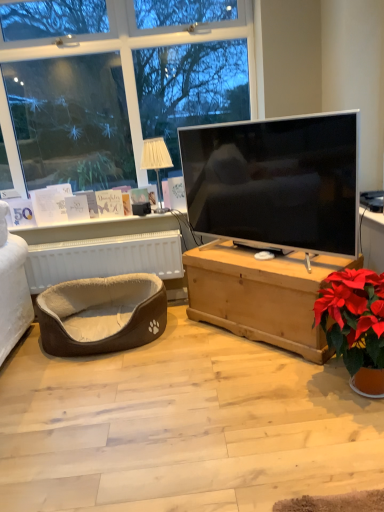
Question: Considering their positions, is white fabric lampshade at upper center located in front of or behind matte black tv at center?

Choices:
 (A) behind
 (B) front

Answer: (A)

Question: From a real-world perspective, is white fabric lampshade at upper center positioned above or below matte black tv at center?

Choices:
 (A) below
 (B) above

Answer: (B)

Question: Which of these objects is positioned closest to the matte black tv at center?

Choices:
 (A) white fabric pet bed at lower left
 (B) white fabric lampshade at upper center
 (C) light brown wooden chest at center
 (D) brown plush pet bed at lower left

Answer: (C)

Question: Which is nearer to the light brown wooden chest at center?

Choices:
 (A) white fabric pet bed at lower left
 (B) white fabric lampshade at upper center
 (C) brown plush pet bed at lower left
 (D) matte black tv at center

Answer: (D)